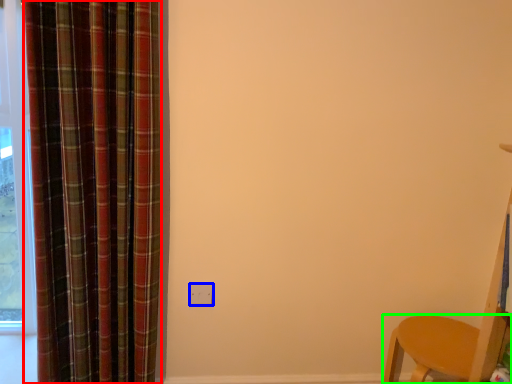
Question: Which object is the farthest from curtain (highlighted by a red box)? Choose among these: electric outlet (highlighted by a blue box) or furniture (highlighted by a green box).

Choices:
 (A) electric outlet
 (B) furniture

Answer: (B)